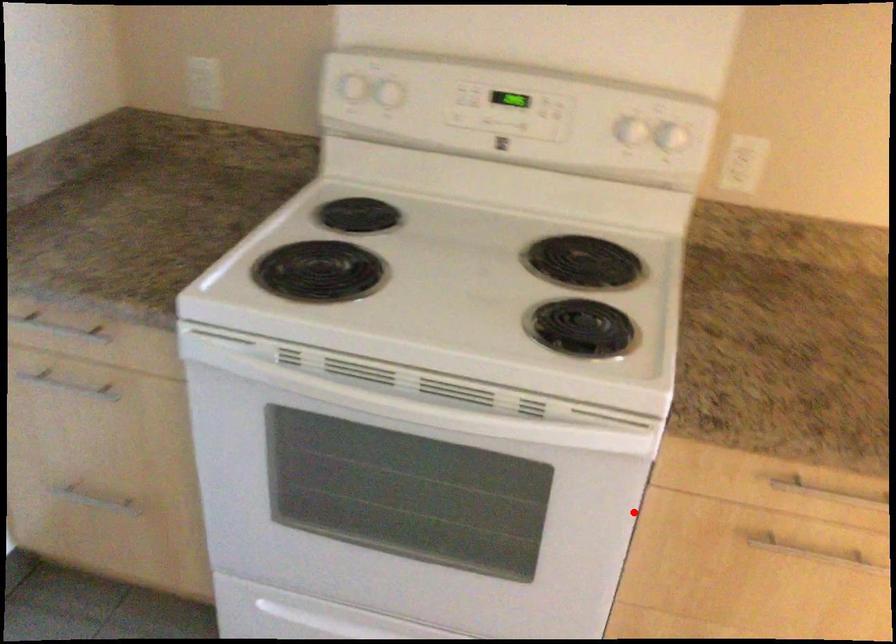
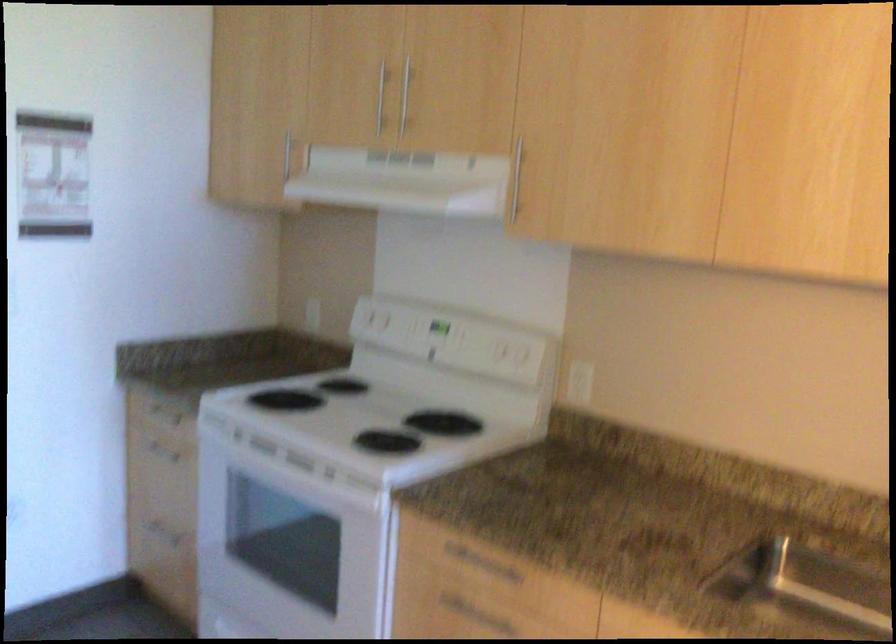
In the second image, find the point that corresponds to the highlighted location in the first image.

(385, 571)